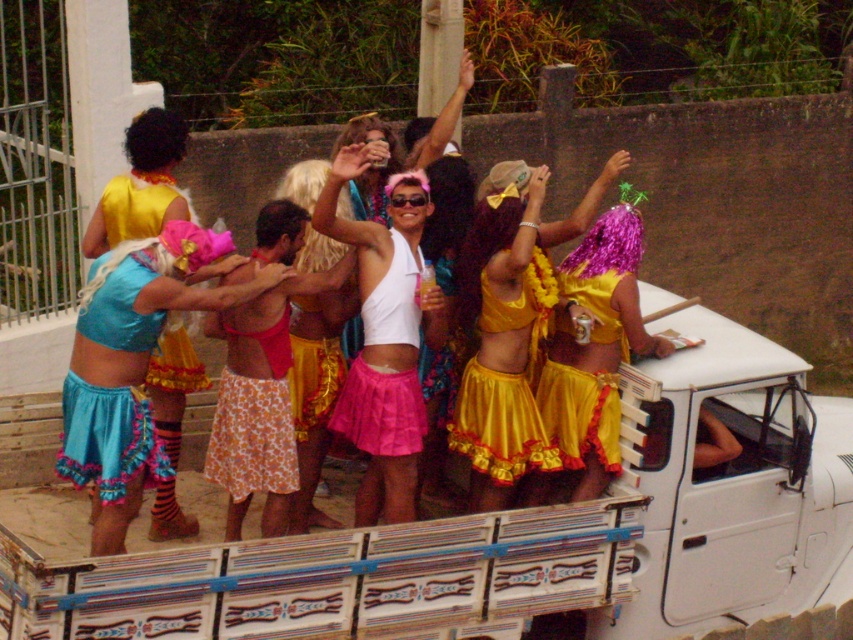
Question: Which point is farther to the camera?

Choices:
 (A) (474, 365)
 (B) (598, 330)

Answer: (A)

Question: Which of the following is the farthest from the observer?

Choices:
 (A) yellow satin skirt at center
 (B) yellow satin dress at center

Answer: (B)

Question: Does blue satin skirt at center lie behind yellow satin dress at center?

Choices:
 (A) no
 (B) yes

Answer: (A)

Question: Is blue satin skirt at center to the left of yellow satin skirt at center from the viewer's perspective?

Choices:
 (A) no
 (B) yes

Answer: (B)

Question: Is yellow satin skirt at center to the right of yellow satin dress at center from the viewer's perspective?

Choices:
 (A) yes
 (B) no

Answer: (B)

Question: Which point appears closest to the camera in this image?

Choices:
 (A) (543, 388)
 (B) (525, 468)

Answer: (B)